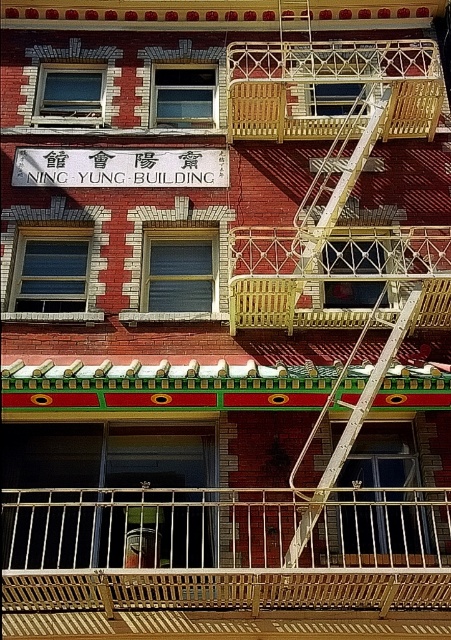
You are a painter who needs to know which object is shorter between the white matte sign at center and the white metal fire escape at upper center. Can you help me determine this?

The white matte sign at center has a lesser height compared to the white metal fire escape at upper center, so the white matte sign at center is shorter.

You are standing in front of the Ning Yung Building and notice two objects on its facade. One is the wooden at center and the other is the white matte sign at center. Which object is positioned to the right when viewed from the front?

The wooden at center is to the right of the white matte sign at center.

You are standing in front of the Ning Yung Building and want to read the white matte sign at center. There is a white metal fire escape at center below it. Can you easily read the sign without climbing the fire escape?

The white matte sign at center is located above the white metal fire escape at center, so you can easily read the sign without needing to climb the fire escape as it is positioned higher up.